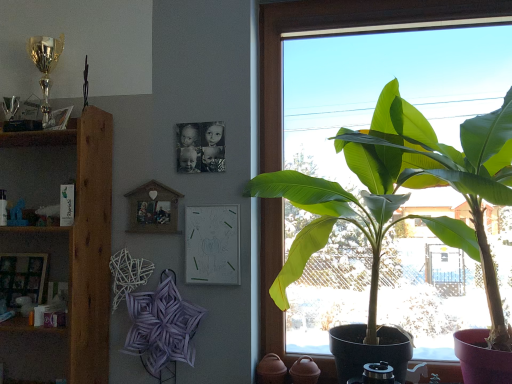
Question: Is wooden shelf at left wider or thinner than wooden shelf at left?

Choices:
 (A) wide
 (B) thin

Answer: (B)

Question: Is wooden shelf at left to the left or to the right of wooden shelf at left in the image?

Choices:
 (A) right
 (B) left

Answer: (A)

Question: Based on their relative distances, which object is farther from the wooden picture frame at lower left, the 3th picture frame from the right?

Choices:
 (A) wooden photo frame at upper center, positioned as the second picture frame in right-to-left order
 (B) transparent glass window at right
 (C) wooden shelf at left
 (D) wooden shelf at left
 (E) white paper at center, which is the 3th picture frame in left-to-right order

Answer: (B)

Question: Estimate the real-world distances between objects in this image. Which object is farther from the wooden shelf at left?

Choices:
 (A) green leafy plant at right
 (B) wooden photo frame at upper center, positioned as the second picture frame in left-to-right order
 (C) white paper at center, the 1th picture frame viewed from the right
 (D) transparent glass window at right
 (E) wooden picture frame at lower left, the 3th picture frame from the right

Answer: (A)